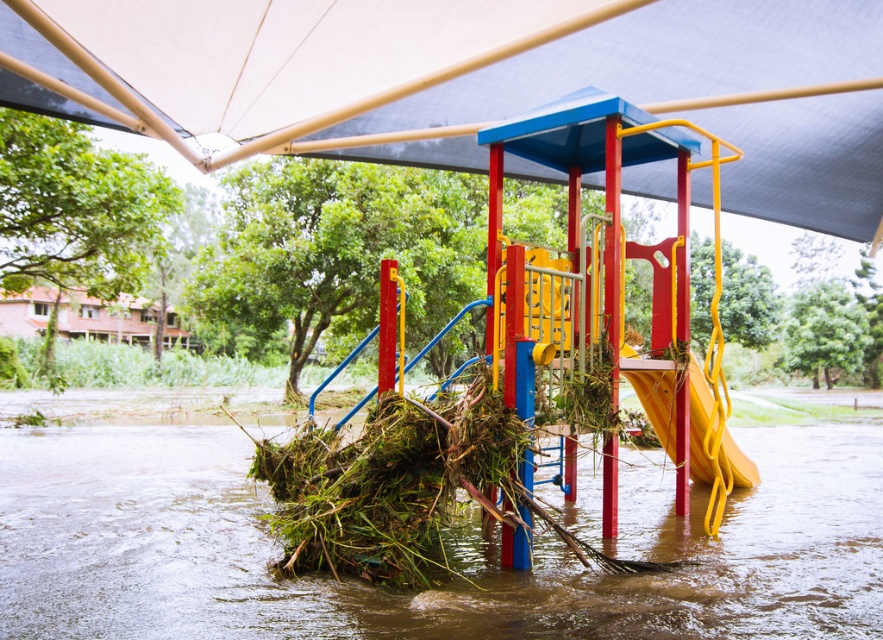
Question: Can you confirm if white fabric canopy at upper center is wider than brown muddy water at center?

Choices:
 (A) no
 (B) yes

Answer: (A)

Question: Can you confirm if brown muddy water at center is positioned to the right of yellow matte slide at lower right?

Choices:
 (A) yes
 (B) no

Answer: (B)

Question: Which point is closer to the camera taking this photo?

Choices:
 (A) (118, 458)
 (B) (757, 22)

Answer: (B)

Question: Based on their relative distances, which object is nearer to the brown muddy water at center?

Choices:
 (A) yellow matte slide at lower right
 (B) white fabric canopy at upper center

Answer: (A)

Question: Which object is farther from the camera taking this photo?

Choices:
 (A) brown muddy water at center
 (B) yellow matte slide at lower right
 (C) white fabric canopy at upper center

Answer: (B)

Question: Is white fabric canopy at upper center wider than brown muddy water at center?

Choices:
 (A) yes
 (B) no

Answer: (B)